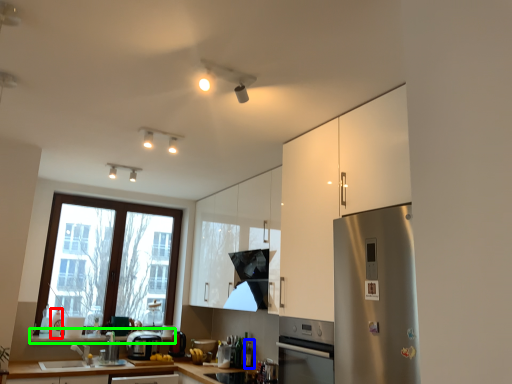
Question: Estimate the real-world distances between objects in this image. Which object is closer to bottle (highlighted by a red box), bottle (highlighted by a blue box) or window sill (highlighted by a green box)?

Choices:
 (A) bottle
 (B) window sill

Answer: (B)